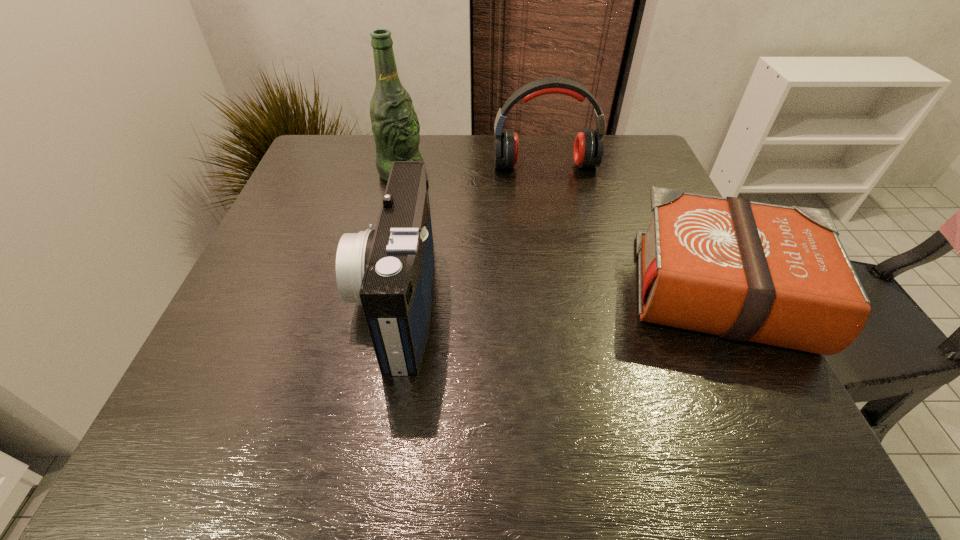
Identify the location of free space on the desktop that is between the camcorder and the Bible and is positioned on the surface of the tallest object. The image size is (960, 540). (600, 294).

This screenshot has height=540, width=960. Find the location of `free spot on the desktop that is between the camcorder and the shortest object and is positioned on the ear cups of the earphone`. free spot on the desktop that is between the camcorder and the shortest object and is positioned on the ear cups of the earphone is located at coordinates (573, 295).